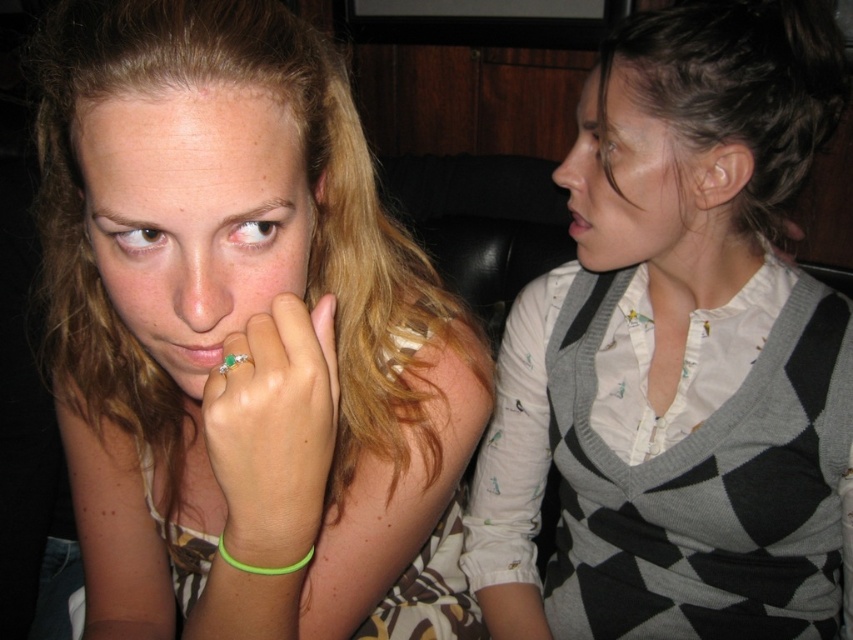
Is smooth skin face at upper right below matte gray hair at upper right?

Indeed, smooth skin face at upper right is positioned under matte gray hair at upper right.

Between point (672, 276) and point (776, 256), which one is positioned in front?

Point (672, 276) is in front.

Locate an element on the screen. This screenshot has height=640, width=853. smooth skin face at upper right is located at coordinates (633, 184).

Locate an element on the screen. The width and height of the screenshot is (853, 640). smooth skin face at upper right is located at coordinates (633, 184).

Measure the distance between smooth skin face at upper right and green rubber band at lower center.

smooth skin face at upper right is 42.42 centimeters from green rubber band at lower center.

Is point (627, 99) positioned after point (273, 572)?

That is True.

Locate an element on the screen. smooth skin face at upper right is located at coordinates (633, 184).

This screenshot has width=853, height=640. I want to click on smooth skin face at upper right, so click(633, 184).

Does matte gold ring at center have a lesser height compared to smooth skin face at upper right?

Indeed, matte gold ring at center has a lesser height compared to smooth skin face at upper right.

Is point (280, 292) less distant than point (619, 264)?

Yes, point (280, 292) is in front of point (619, 264).

Find the location of a particular element. Image resolution: width=853 pixels, height=640 pixels. matte gold ring at center is located at coordinates (200, 225).